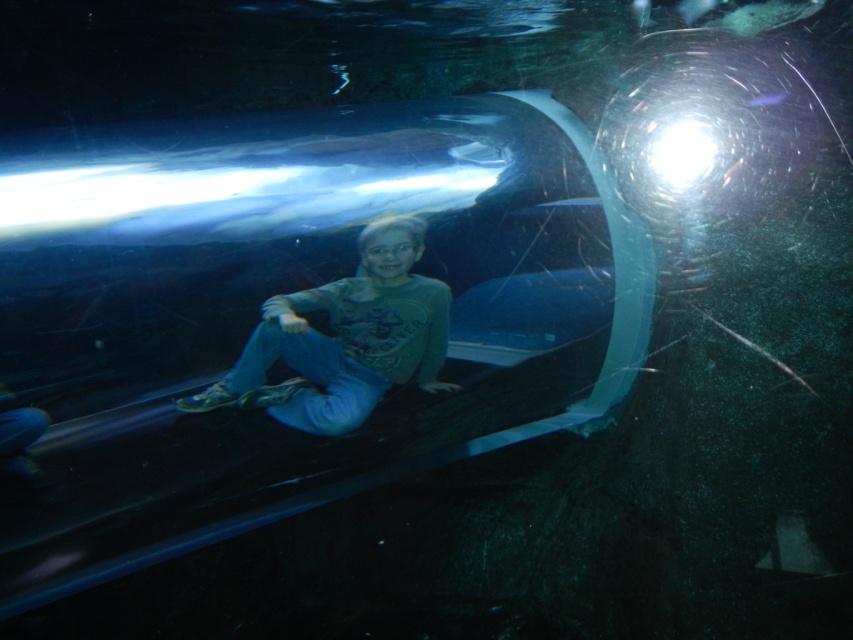
Who is lower down, matte gray shirt at center or transparent glass bubble at upper center?

Positioned lower is matte gray shirt at center.

Can you confirm if matte gray shirt at center is positioned above transparent glass bubble at upper center?

No.

Describe the element at coordinates (346, 337) in the screenshot. This screenshot has height=640, width=853. I see `matte gray shirt at center` at that location.

You are a GUI agent. You are given a task and a screenshot of the screen. Output one action in this format:
    pyautogui.click(x=<x>, y=<y>)
    Task: Click on the matte gray shirt at center
    The image size is (853, 640).
    Given the screenshot: What is the action you would take?
    pyautogui.click(x=346, y=337)